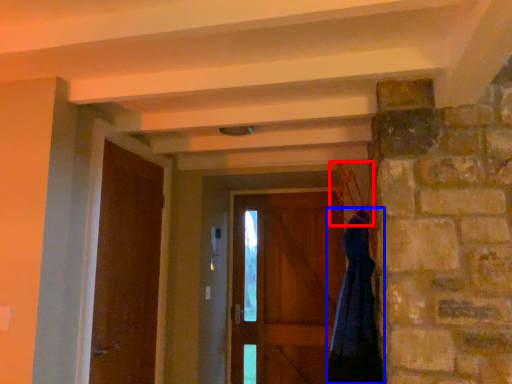
Question: Among these objects, which one is nearest to the camera, hanger (highlighted by a red box) or dress (highlighted by a blue box)?

Choices:
 (A) hanger
 (B) dress

Answer: (A)